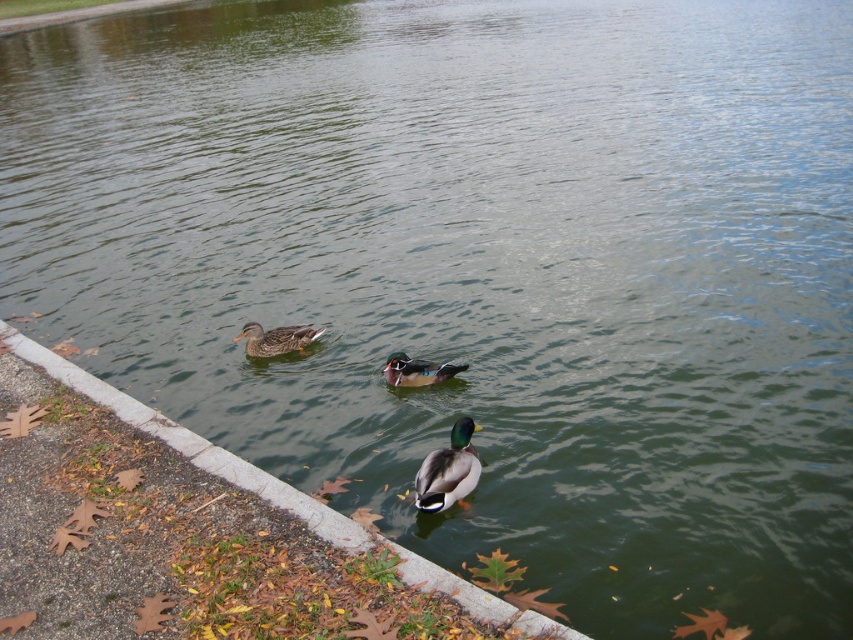
Looking at this image, you are standing at the edge of the pond and looking out at the ducks swimming in the water. There are two points marked on the water surface, one at coordinates point (440, 465) and the other at point (253, 348). Which of these two points is closer to your current position?

Point (440, 465) is closer to the camera than point (253, 348), so the point at coordinates point (440, 465) is closer to your current position.